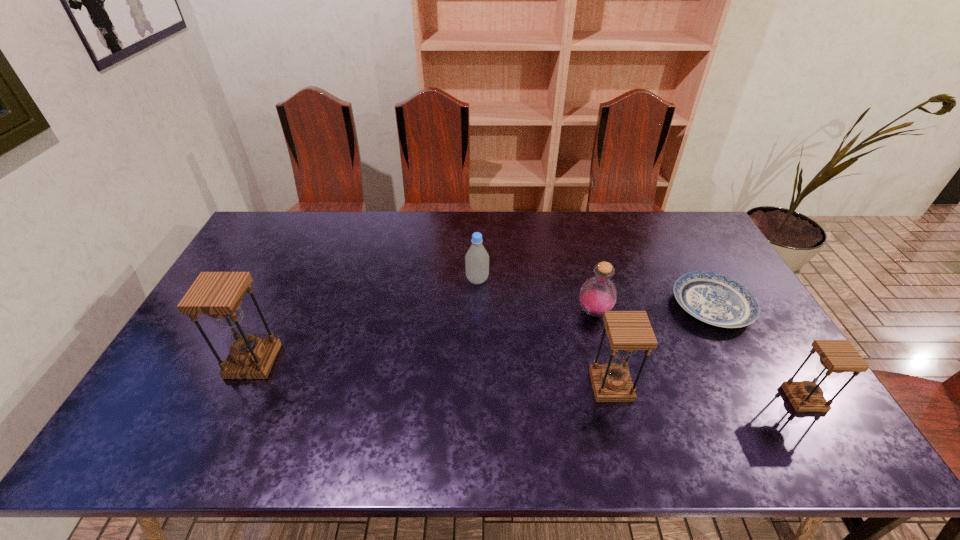
Where is `the leftmost object`? the leftmost object is located at coordinates (219, 295).

Where is `the leftmost hourglass`? the leftmost hourglass is located at coordinates (219, 295).

Identify the location of the second hourglass from right to left. This screenshot has width=960, height=540. [x=628, y=331].

This screenshot has height=540, width=960. Find the location of `the second shortest hourglass`. the second shortest hourglass is located at coordinates (628, 331).

Locate an element on the screen. The width and height of the screenshot is (960, 540). the shortest hourglass is located at coordinates (836, 356).

Locate an element on the screen. This screenshot has width=960, height=540. plate is located at coordinates (715, 299).

Where is `the fifth object from right to left`? The image size is (960, 540). the fifth object from right to left is located at coordinates (477, 258).

Locate an element on the screen. the farther bottle is located at coordinates (477, 258).

Locate an element on the screen. the nearer bottle is located at coordinates (598, 294).

Find the location of a particular element. The image size is (960, 540). vacant space located on the right of the tallest object is located at coordinates (353, 361).